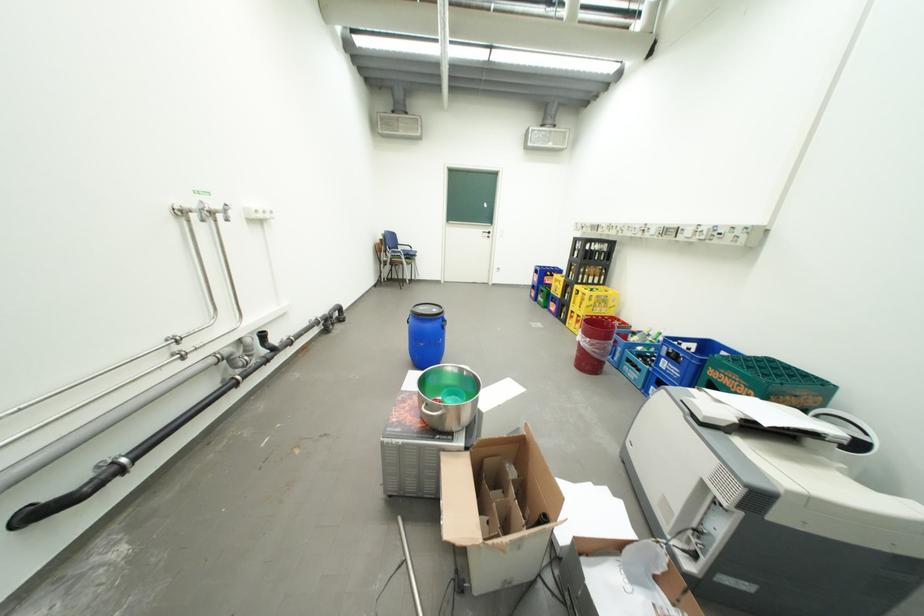
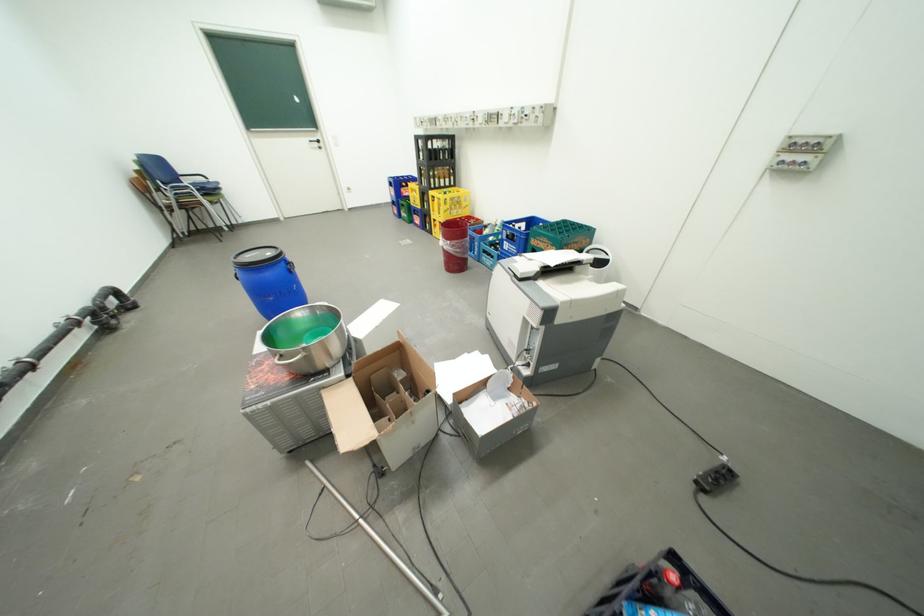
Based on the continuous images, in which direction is the camera rotating?

The rotation direction of the camera is right-down.